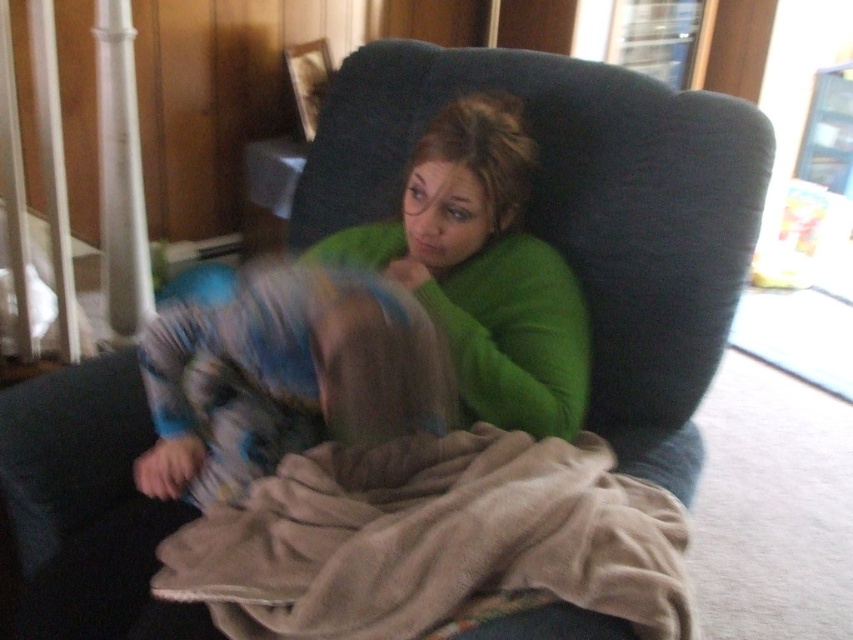
Question: Can you confirm if green soft sweater at center is positioned to the left of blue and white fabric at center?

Choices:
 (A) no
 (B) yes

Answer: (A)

Question: Does beige soft blanket at center have a larger size compared to green soft sweater at center?

Choices:
 (A) yes
 (B) no

Answer: (B)

Question: Which point is closer to the camera?

Choices:
 (A) beige soft blanket at center
 (B) green soft sweater at center

Answer: (A)

Question: Which object is positioned closest to the beige soft blanket at center?

Choices:
 (A) green soft sweater at center
 (B) blue and white fabric at center

Answer: (B)

Question: Which is farther from the green soft sweater at center?

Choices:
 (A) beige soft blanket at center
 (B) blue and white fabric at center

Answer: (A)

Question: Can you confirm if green soft sweater at center is thinner than blue and white fabric at center?

Choices:
 (A) yes
 (B) no

Answer: (B)